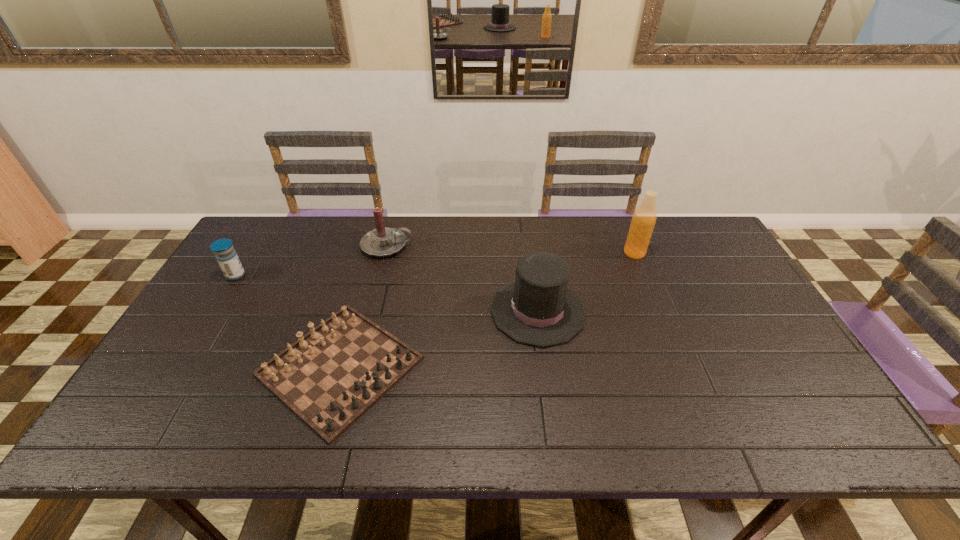
Where is `vacant point located on the front of the dress hat with the decoration`? vacant point located on the front of the dress hat with the decoration is located at coordinates (409, 311).

In order to click on free space located 0.180m on the side of the candle with the handle loop in this screenshot , I will do `click(467, 246)`.

Find the location of a particular element. The image size is (960, 540). vacant space located 0.230m on the front of the second shortest object is located at coordinates (196, 341).

You are a GUI agent. You are given a task and a screenshot of the screen. Output one action in this format:
    pyautogui.click(x=<x>, y=<y>)
    Task: Click on the vacant space located on the right of the shortest object
    The image size is (960, 540).
    Given the screenshot: What is the action you would take?
    pyautogui.click(x=567, y=367)

Where is `beer bottle that is at the far edge`? Image resolution: width=960 pixels, height=540 pixels. beer bottle that is at the far edge is located at coordinates (643, 221).

The image size is (960, 540). I want to click on candle that is at the far edge, so click(383, 241).

The image size is (960, 540). Identify the location of object that is at the near edge. (331, 376).

The image size is (960, 540). Identify the location of object that is at the left edge. (x=227, y=258).

Where is `free space at the far edge of the desktop`? The image size is (960, 540). free space at the far edge of the desktop is located at coordinates (499, 235).

I want to click on vacant space at the near edge, so click(428, 416).